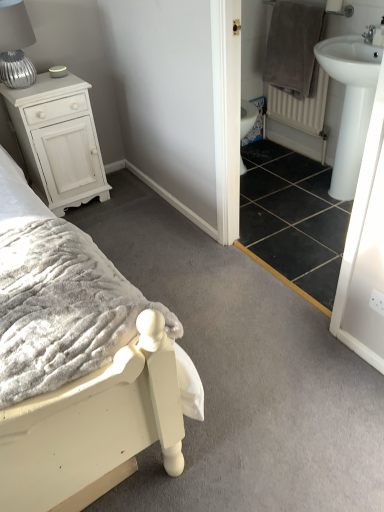
Locate an element on the screen. vacant space underneath silver ribbed table lamp at left (from a real-world perspective) is located at coordinates (26, 84).